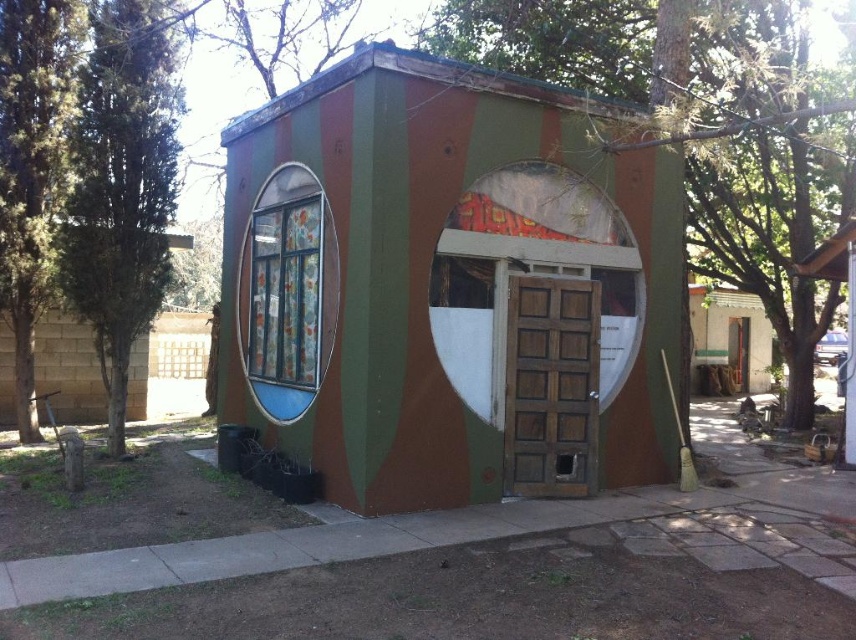
Between point (530, 433) and point (736, 358), which one is positioned in front?

Point (530, 433)

Is camouflage paint hut at center taller than white painted wood door at center?

Yes, camouflage paint hut at center is taller than white painted wood door at center.

The height and width of the screenshot is (640, 856). In order to click on camouflage paint hut at center in this screenshot , I will do 449,284.

Where is `camouflage paint hut at center`? camouflage paint hut at center is located at coordinates (449, 284).